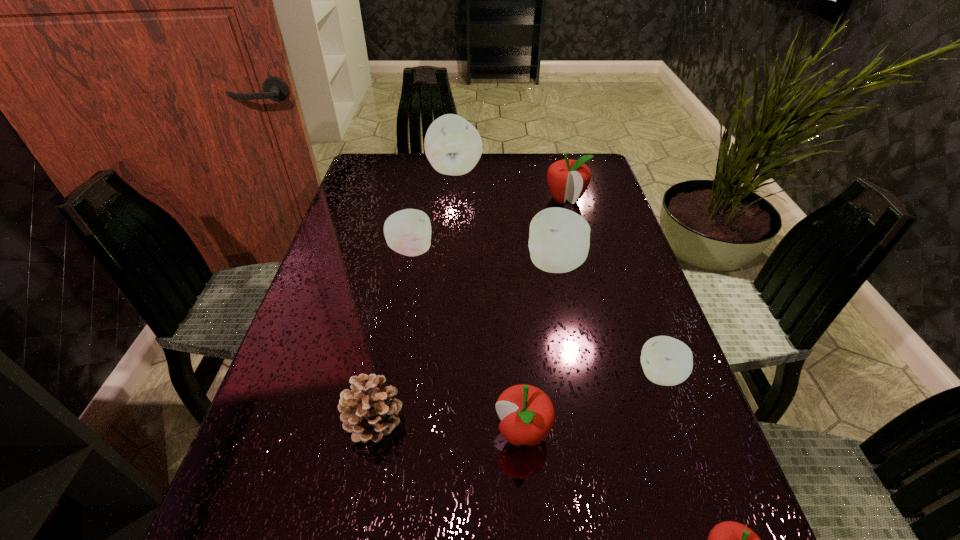
Locate an element on the screen. Image resolution: width=960 pixels, height=540 pixels. the fifth closest object to the second white apple from right to left is located at coordinates (453, 146).

I want to click on apple that is the third closest to the smallest red apple, so click(x=559, y=239).

Identify which apple is the sixth nearest to the second smallest red apple. Please provide its 2D coordinates. Your answer should be formatted as a tuple, i.e. [(x, y)], where the tuple contains the x and y coordinates of a point satisfying the conditions above.

[(453, 146)]

Identify which white apple is the fourth closest to the second farthest object. Please provide its 2D coordinates. Your answer should be formatted as a tuple, i.e. [(x, y)], where the tuple contains the x and y coordinates of a point satisfying the conditions above.

[(667, 361)]

Identify which white apple is the nearest to the third biggest white apple. Please provide its 2D coordinates. Your answer should be formatted as a tuple, i.e. [(x, y)], where the tuple contains the x and y coordinates of a point satisfying the conditions above.

[(559, 239)]

Find the location of `red apple that is the second closest to the pinecone`. red apple that is the second closest to the pinecone is located at coordinates (729, 539).

Select which red apple appears as the second closest to the smallest white apple. Please provide its 2D coordinates. Your answer should be formatted as a tuple, i.e. [(x, y)], where the tuple contains the x and y coordinates of a point satisfying the conditions above.

[(729, 539)]

Where is `blank area in the image that satisfies the following two spatial constraints: 1. on the front side of the third biggest white apple; 2. on the right side of the second farthest red apple`? This screenshot has height=540, width=960. blank area in the image that satisfies the following two spatial constraints: 1. on the front side of the third biggest white apple; 2. on the right side of the second farthest red apple is located at coordinates (378, 433).